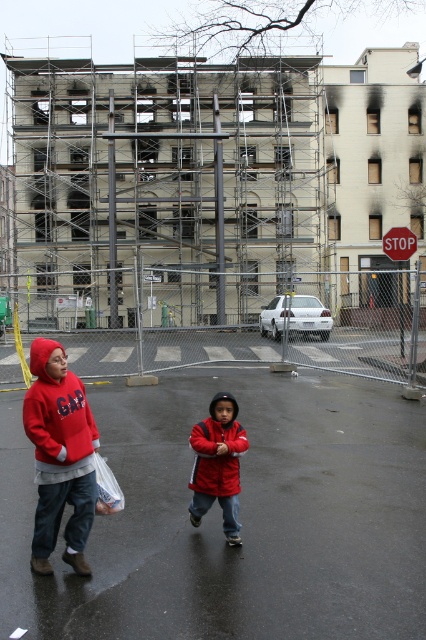
You are standing at the camera position and want to reach the point marked as point (34, 310). If your walking speed is 1.5 meters per second, how many seconds will it take you to reach there?

The point (34, 310) is 35.76 meters away from the camera. At a walking speed of 1.5 meters per second, it would take 35.76 divided by 1.5, which equals approximately 23.84 seconds to reach there.

You are a delivery person trying to navigate through the construction area. You see the white plastic bag at lower left and the red plastic stop sign at center. Which object is closer to the left side of the path?

The white plastic bag at lower left is closer to the left side of the path because it is positioned to the left of the red plastic stop sign at center.

You are a delivery person trying to navigate through the construction area. You see the metal scaffolding at upper center and the red plastic stop sign at center. Which object is wider from your perspective?

The metal scaffolding at upper center might be wider than red plastic stop sign at center.